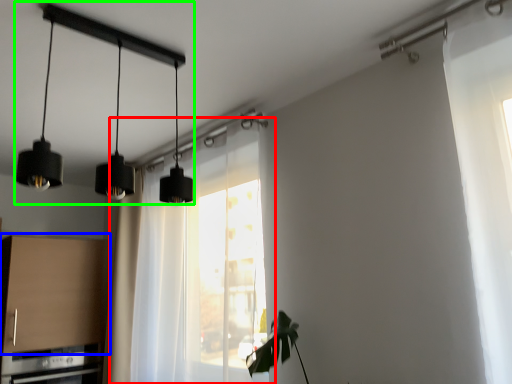
Question: Considering the real-world distances, which object is farthest from window (highlighted by a red box)? cabinetry (highlighted by a blue box) or lamp (highlighted by a green box)?

Choices:
 (A) cabinetry
 (B) lamp

Answer: (B)